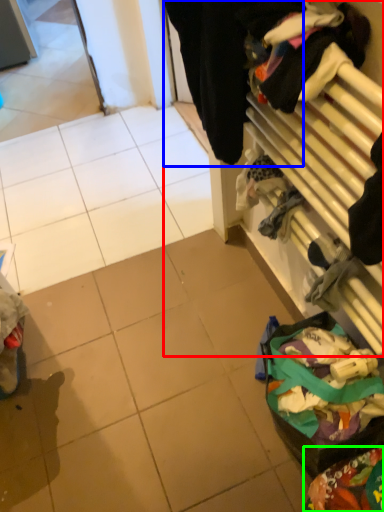
Question: Which is nearer to the closet (highlighted by a red box)? clothing (highlighted by a blue box) or waste (highlighted by a green box).

Choices:
 (A) clothing
 (B) waste

Answer: (A)